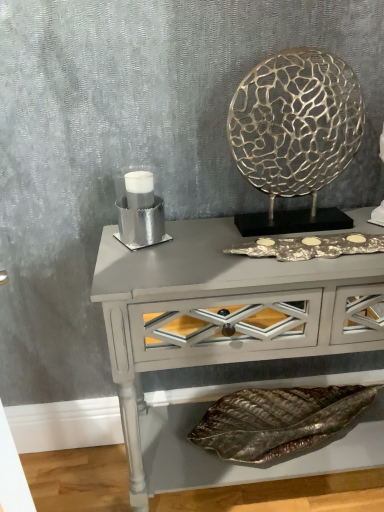
I want to click on empty space that is ontop of matte gray console table at center (from a real-world perspective), so click(x=215, y=252).